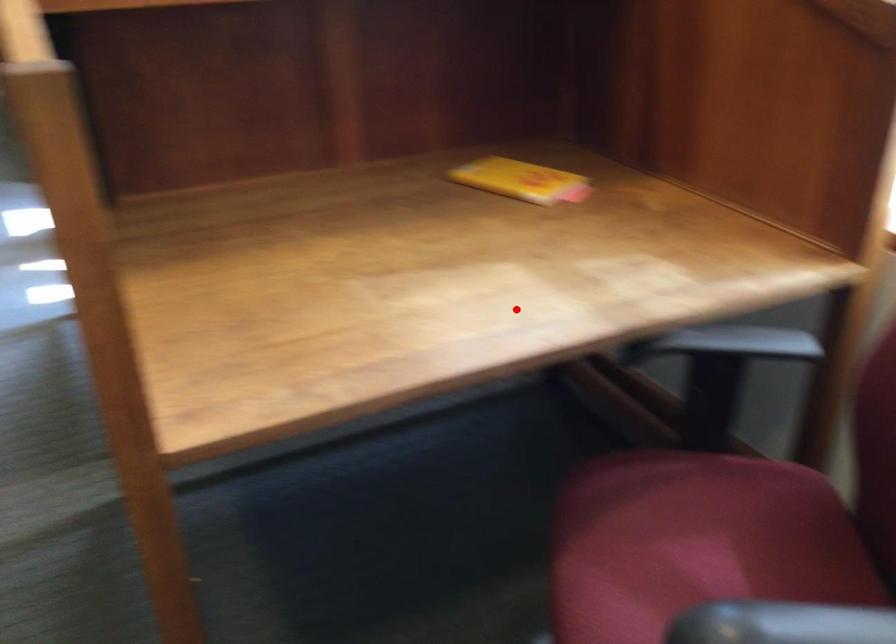
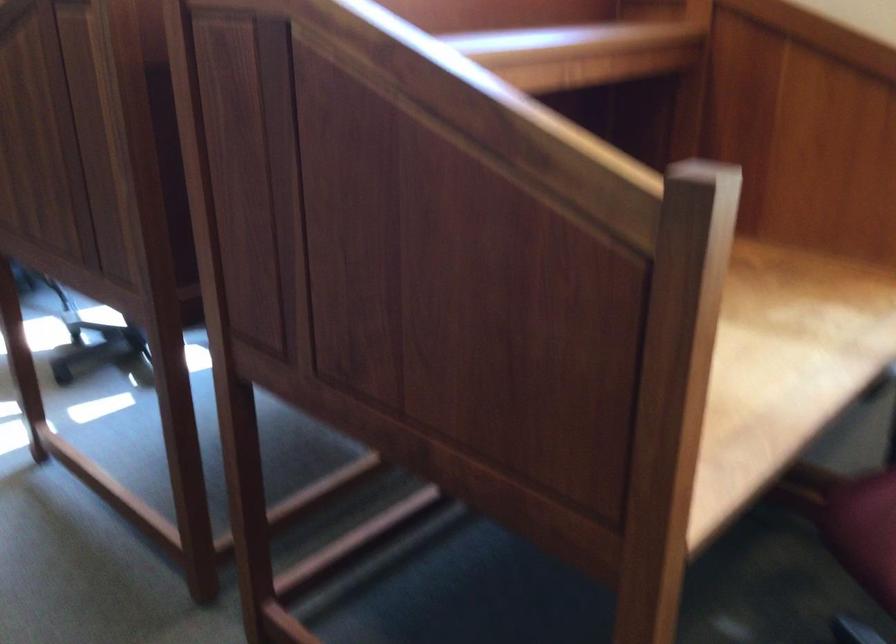
Question: I am providing you with two images of the same scene from different viewpoints. In image1, a red point is highlighted. Considering the same 3D point in image2, which of the following is correct?

Choices:
 (A) It is closer
 (B) It is farther

Answer: (B)